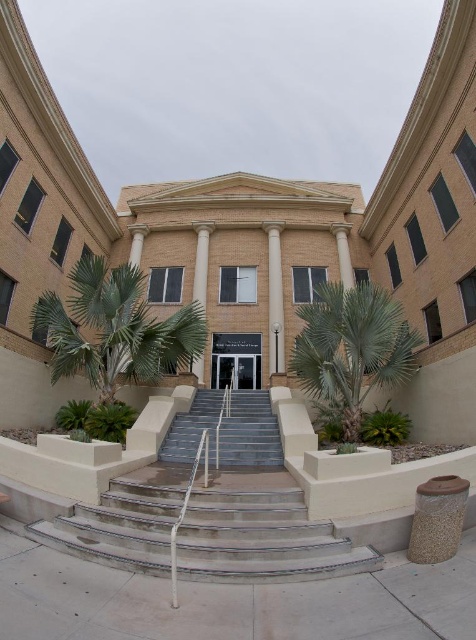
Does green leafy palm tree at left appear under matte glass door at center?

Actually, green leafy palm tree at left is above matte glass door at center.

Consider the image. Does green leafy palm tree at left have a greater height compared to matte glass door at center?

Correct, green leafy palm tree at left is much taller as matte glass door at center.

Between point (160, 358) and point (234, 364), which one is positioned in front?

Point (160, 358) is in front.

The width and height of the screenshot is (476, 640). Identify the location of green leafy palm tree at left. (115, 328).

Can you confirm if white marble pillar at center is taller than white smooth column at center?

No.

Which of these two, white marble pillar at center or white smooth column at center, stands shorter?

With less height is white marble pillar at center.

Who is more forward, [277,300] or [205,275]?

Point [277,300] is in front.

Locate an element on the screen. The image size is (476, 640). white marble pillar at center is located at coordinates (275, 298).

Does matte glass door at center have a lesser width compared to white smooth column at center?

In fact, matte glass door at center might be wider than white smooth column at center.

Who is more distant from viewer, (x=228, y=364) or (x=198, y=285)?

The point (x=198, y=285) is behind.

Who is more distant from viewer, (241, 381) or (199, 364)?

The point (241, 381) is behind.

The width and height of the screenshot is (476, 640). What are the coordinates of `matte glass door at center` in the screenshot? It's located at (236, 358).